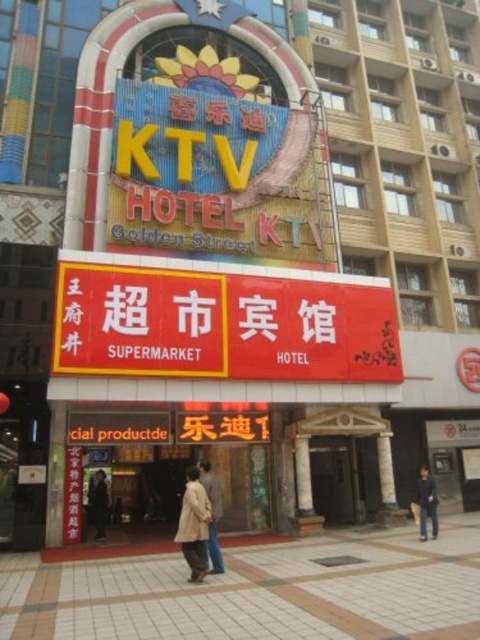
You are standing at the entrance of the commercial building and want to read the text on the yellow matte signboard at center. Considering your current position, do you think you can read the text clearly without moving closer?

The yellow matte signboard at center is 40.89 meters away from viewer, so it is too far to read the text clearly without moving closer.

You are a customer entering the building and see the light brown leather jacket at center and the dark blue jacket at lower right hanging near the entrance. Which jacket is closer to the entrance door?

The light brown leather jacket at center is closer to the entrance door because it is to the left of the dark blue jacket at lower right, which is further away from the entrance.

You are standing at the entrance of the commercial building and see two points marked on the facade. One is at point (417, 486) and the other at point (99, 538). Which point is closer to you?

Point (99, 538) is closer to you because it is in front of point (417, 486).